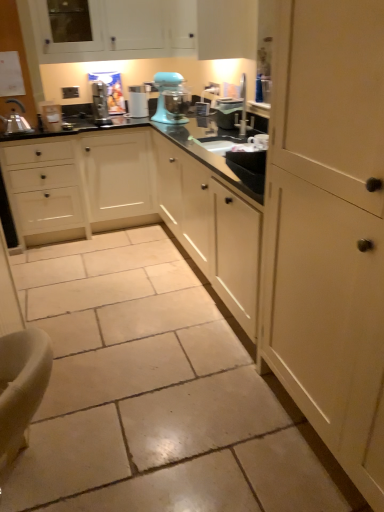
Question: From the image's perspective, would you say black glossy countertop at center is positioned over teal matte stand mixer at center?

Choices:
 (A) no
 (B) yes

Answer: (A)

Question: Is black glossy countertop at center at the left side of teal matte stand mixer at center?

Choices:
 (A) no
 (B) yes

Answer: (B)

Question: From a real-world perspective, is black glossy countertop at center over teal matte stand mixer at center?

Choices:
 (A) yes
 (B) no

Answer: (B)

Question: Is black glossy countertop at center positioned with its back to teal matte stand mixer at center?

Choices:
 (A) yes
 (B) no

Answer: (B)

Question: Does black glossy countertop at center contain teal matte stand mixer at center?

Choices:
 (A) no
 (B) yes

Answer: (A)

Question: Based on their sizes in the image, would you say white plastic toaster at left, acting as the first appliance starting from the left, is bigger or smaller than teal matte stand mixer at center?

Choices:
 (A) small
 (B) big

Answer: (A)

Question: In terms of height, does white plastic toaster at left, acting as the first appliance starting from the left, look taller or shorter compared to teal matte stand mixer at center?

Choices:
 (A) short
 (B) tall

Answer: (A)

Question: From a real-world perspective, is white plastic toaster at left, the 2th appliance positioned from the right, above or below teal matte stand mixer at center?

Choices:
 (A) above
 (B) below

Answer: (B)

Question: From the image's perspective, is white plastic toaster at left, acting as the first appliance starting from the left, located above or below teal matte stand mixer at center?

Choices:
 (A) below
 (B) above

Answer: (A)

Question: From the image's perspective, relative to white glossy sink at center, is white plastic coffee machine at center above or below?

Choices:
 (A) below
 (B) above

Answer: (B)

Question: Does point (129, 115) appear closer or farther from the camera than point (236, 131)?

Choices:
 (A) farther
 (B) closer

Answer: (A)

Question: In the image, is white plastic coffee machine at center positioned in front of or behind white glossy sink at center?

Choices:
 (A) behind
 (B) front

Answer: (A)

Question: Is white plastic coffee machine at center inside the boundaries of white glossy sink at center, or outside?

Choices:
 (A) outside
 (B) inside

Answer: (A)

Question: From the image's perspective, relative to matte cream cabinet at right, positioned as the first cabinetry in right-to-left order, is white plastic coffee machine at center above or below?

Choices:
 (A) above
 (B) below

Answer: (A)

Question: Is white plastic coffee machine at center taller or shorter than matte cream cabinet at right, the 2th cabinetry from the left?

Choices:
 (A) tall
 (B) short

Answer: (B)